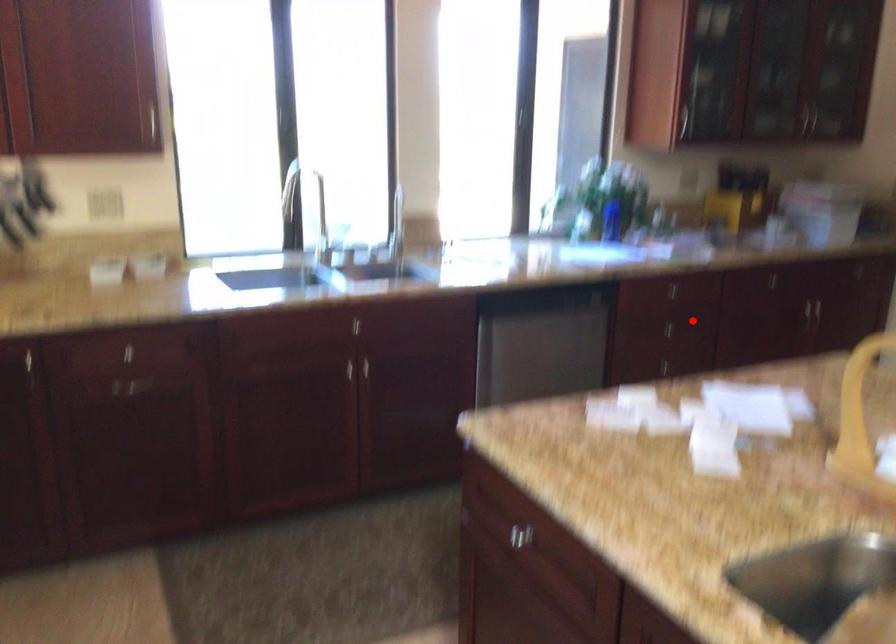
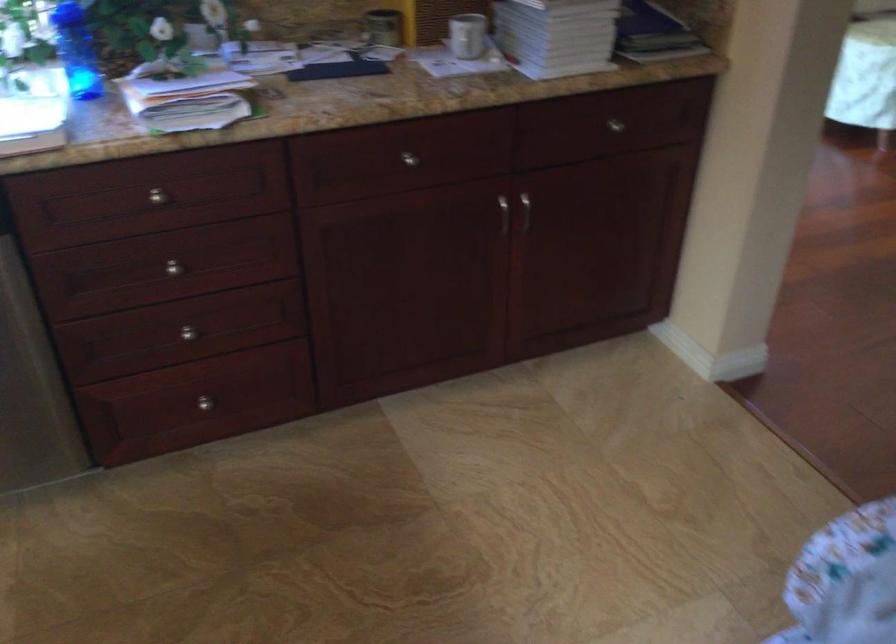
Question: I am providing you with two images of the same scene from different viewpoints. A red point is shown in image1. For the corresponding object point in image2, is it positioned nearer or farther from the camera?

Choices:
 (A) Nearer
 (B) Farther

Answer: (A)